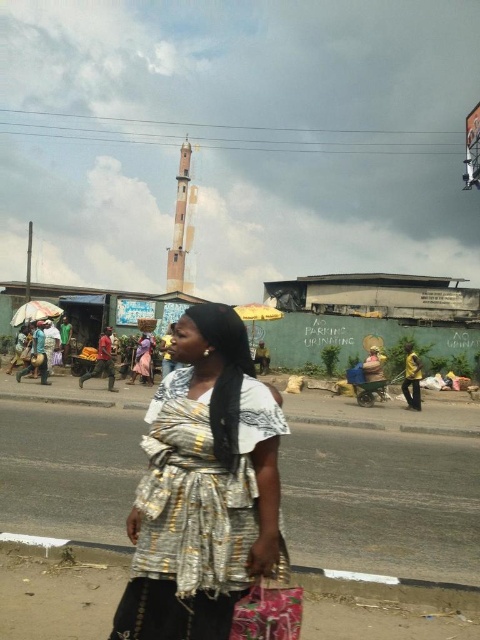
Does point (160, 461) come closer to viewer compared to point (243, 614)?

No, (160, 461) is further to viewer.

Where is `silver metallic dress at center`? This screenshot has width=480, height=640. silver metallic dress at center is located at coordinates (204, 486).

Which is more to the right, floral fabric bag at lower center or yellow fabric at right?

From the viewer's perspective, yellow fabric at right appears more on the right side.

Can you confirm if floral fabric bag at lower center is positioned to the right of yellow fabric at right?

No, floral fabric bag at lower center is not to the right of yellow fabric at right.

Who is more forward, (290, 625) or (407, 388)?

Point (290, 625)

Locate an element on the screen. Image resolution: width=480 pixels, height=640 pixels. floral fabric bag at lower center is located at coordinates (268, 611).

Can you confirm if silver metallic dress at center is positioned above yellow fabric at right?

Correct, silver metallic dress at center is located above yellow fabric at right.

Between silver metallic dress at center and yellow fabric at right, which one is positioned lower?

Positioned lower is yellow fabric at right.

Describe the element at coordinates (204, 486) in the screenshot. The height and width of the screenshot is (640, 480). I see `silver metallic dress at center` at that location.

The image size is (480, 640). What are the coordinates of `silver metallic dress at center` in the screenshot? It's located at (204, 486).